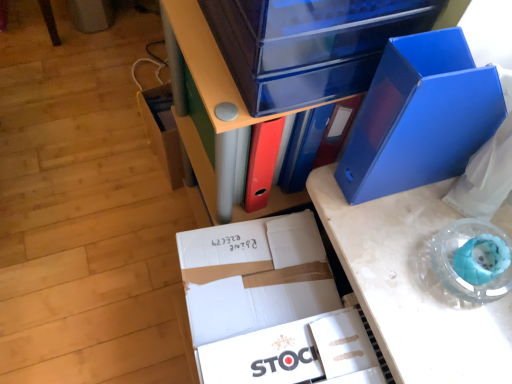
In order to click on blank space situated above white cardboard stock at center, the 1th paperback book from the bottom (from a real-world perspective) in this screenshot , I will do `click(303, 353)`.